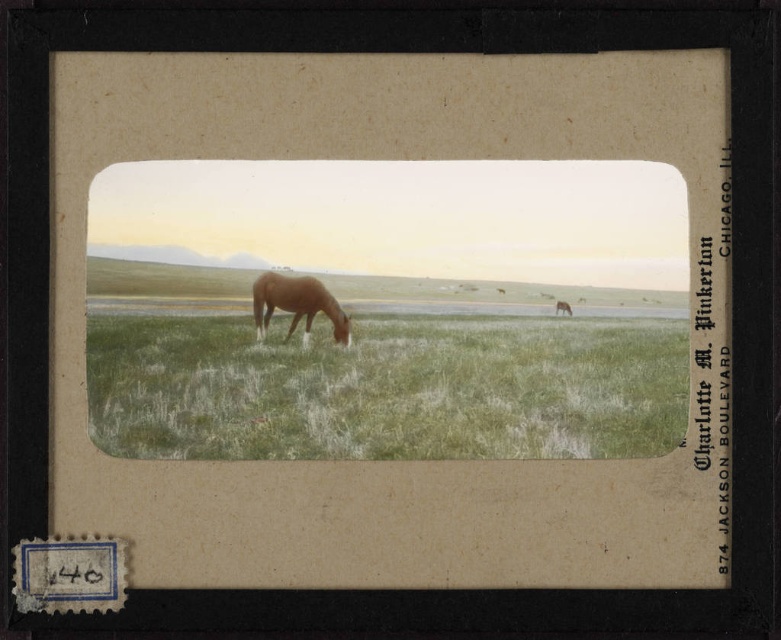
You are a photographer analyzing this vintage image. You need to determine if the green grassy field at center is wider than the light brown horse at center. Can you confirm this based on the scene?

The green grassy field at center is wider than the light brown horse at center, so yes, the green grassy field at center is wider than the light brown horse at center.

You are a photographer analyzing this vintage image. The image has a point marked at coordinates (296, 305). Which object in the scene does this point lie on?

The point at coordinates (296, 305) lies on the light brown horse at center.